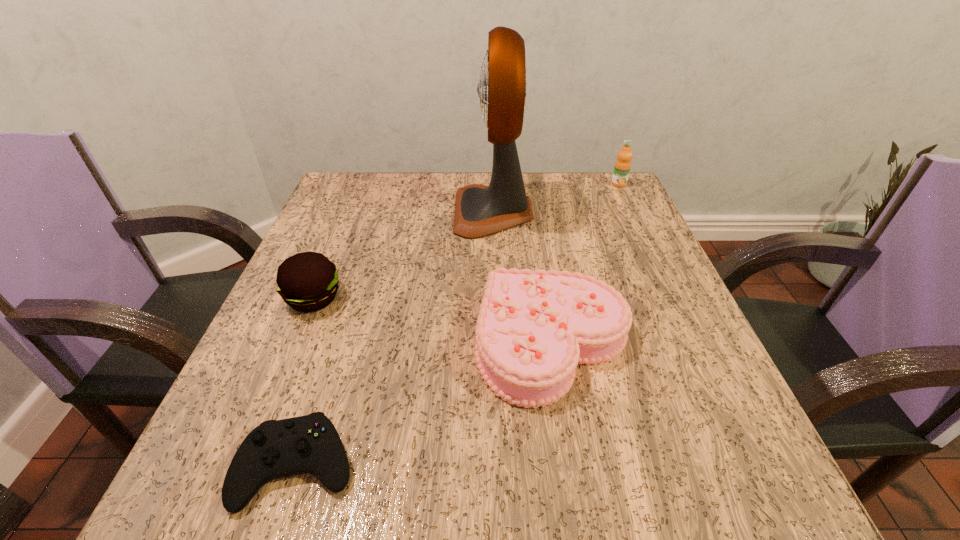
Identify the location of vacant region located 0.120m on the front-facing side of the tallest object. This screenshot has height=540, width=960. (404, 212).

Where is `blank area located on the label of the second tallest object`? blank area located on the label of the second tallest object is located at coordinates click(630, 207).

Locate an element on the screen. vacant position located on the back of the patty is located at coordinates (338, 239).

Find the location of `vacant space located 0.150m on the front of the second shortest object`. vacant space located 0.150m on the front of the second shortest object is located at coordinates (580, 520).

The height and width of the screenshot is (540, 960). Find the location of `free spot located 0.350m on the back of the nearest object`. free spot located 0.350m on the back of the nearest object is located at coordinates (361, 266).

The width and height of the screenshot is (960, 540). Find the location of `fan present at the far edge`. fan present at the far edge is located at coordinates (480, 210).

Where is `orange juice at the far edge`? This screenshot has width=960, height=540. orange juice at the far edge is located at coordinates (622, 167).

The image size is (960, 540). In order to click on object that is at the near edge in this screenshot , I will do `click(275, 449)`.

Image resolution: width=960 pixels, height=540 pixels. I want to click on patty that is at the left edge, so click(x=308, y=281).

At what (x,y) coordinates should I click in order to perform the action: click on control located at the left edge. Please return your answer as a coordinate pair (x, y). Looking at the image, I should click on 275,449.